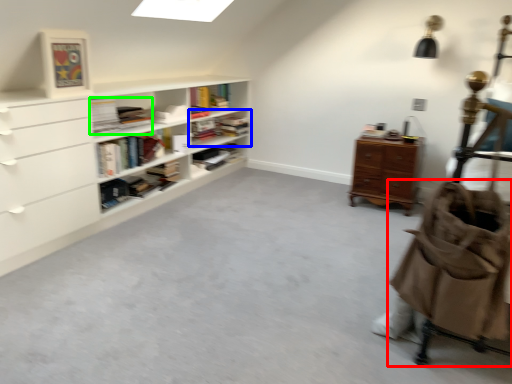
Question: Which is farther away from baby carriage (highlighted by a red box)? shelf (highlighted by a blue box) or book (highlighted by a green box)?

Choices:
 (A) shelf
 (B) book

Answer: (A)